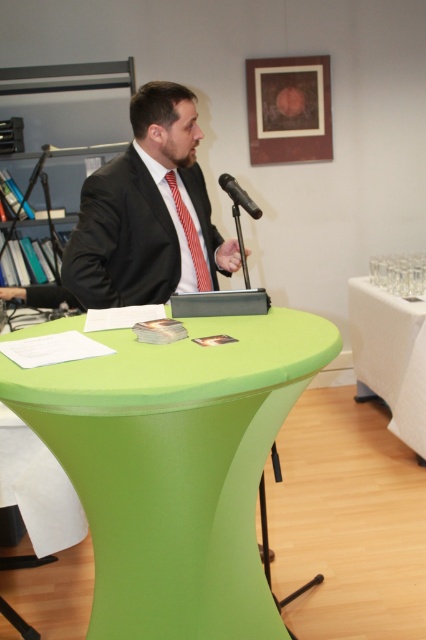
Can you confirm if black suit at center is smaller than red striped tie at center?

Incorrect, black suit at center is not smaller in size than red striped tie at center.

Can you confirm if black suit at center is positioned to the left of red striped tie at center?

Yes, black suit at center is to the left of red striped tie at center.

Which is in front, point (120, 211) or point (170, 188)?

Point (120, 211) is in front.

I want to click on black suit at center, so click(x=146, y=211).

Is green matte table at center behind black metallic microphone at center?

No, green matte table at center is closer to the viewer.

How distant is green matte table at center from black metallic microphone at center?

They are 32.54 inches apart.

Is point (222, 422) farther from viewer compared to point (236, 193)?

No, (222, 422) is closer to viewer.

You are a GUI agent. You are given a task and a screenshot of the screen. Output one action in this format:
    pyautogui.click(x=<x>, y=<y>)
    Task: Click on the green matte table at center
    The image size is (426, 640).
    Given the screenshot: What is the action you would take?
    pyautogui.click(x=175, y=465)

Measure the distance between point (164, 499) and camera.

Point (164, 499) is 3.93 feet from camera.

Is green matte table at center smaller than black suit at center?

Incorrect, green matte table at center is not smaller in size than black suit at center.

Is point (233, 444) positioned after point (106, 180)?

No, it is not.

This screenshot has height=640, width=426. I want to click on green matte table at center, so click(175, 465).